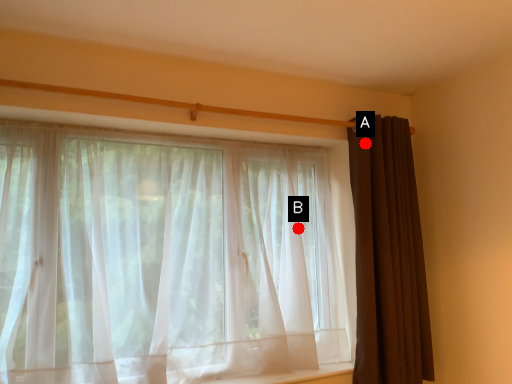
Question: Two points are circled on the image, labeled by A and B beside each circle. Which of the following is the farthest from the observer?

Choices:
 (A) A is further
 (B) B is further

Answer: (B)